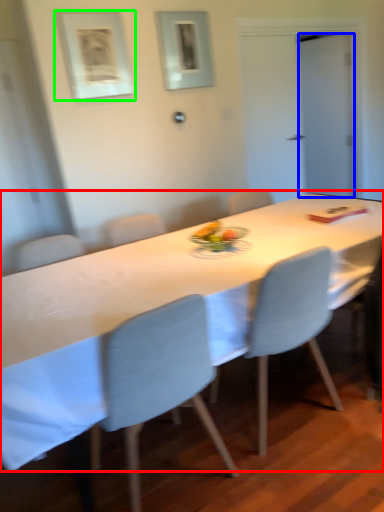
Question: Estimate the real-world distances between objects in this image. Which object is farther from table (highlighted by a red box), glass door (highlighted by a blue box) or picture frame (highlighted by a green box)?

Choices:
 (A) glass door
 (B) picture frame

Answer: (A)